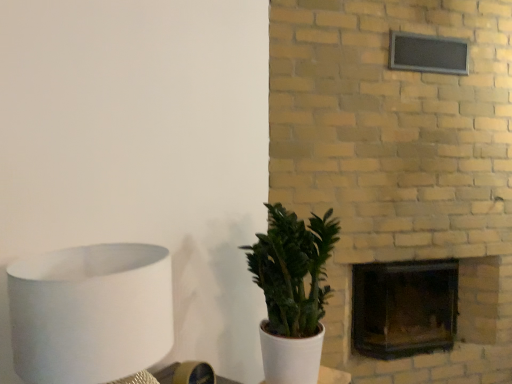
This screenshot has width=512, height=384. Find the location of `black glass fireplace at center-right`. black glass fireplace at center-right is located at coordinates (423, 305).

The width and height of the screenshot is (512, 384). What do you see at coordinates (90, 313) in the screenshot?
I see `white matte lampshade at left` at bounding box center [90, 313].

Identify the location of black glass fireplace at center-right. (423, 305).

Based on the photo, how many degrees apart are the facing directions of black glass fireplace at center-right and green matte plant at center?

There is a 39.9-degree angle between the facing directions of black glass fireplace at center-right and green matte plant at center.

Can you confirm if black glass fireplace at center-right is thinner than green matte plant at center?

No.

Is black glass fireplace at center-right touching green matte plant at center?

black glass fireplace at center-right and green matte plant at center are clearly separated.

Between black glass fireplace at center-right and green matte plant at center, which one has less height?

With less height is black glass fireplace at center-right.

Is black glass fireplace at center-right turned away from white matte lampshade at left?

No, white matte lampshade at left is not at the back of black glass fireplace at center-right.

Looking at this image, can you tell me how much black glass fireplace at center-right and white matte lampshade at left differ in facing direction?

41.7 degrees.

From a real-world perspective, who is located lower, black glass fireplace at center-right or white matte lampshade at left?

In real-world perspective, black glass fireplace at center-right is lower.

Is point (429, 292) more distant than point (71, 370)?

Yes, point (429, 292) is farther from viewer.

From the picture: Does white matte lampshade at left have a greater height compared to green matte plant at center?

Incorrect, the height of white matte lampshade at left is not larger of that of green matte plant at center.

Is white matte lampshade at left to the left or to the right of green matte plant at center in the image?

white matte lampshade at left is to the left of green matte plant at center.

From the image's perspective, which object appears higher, white matte lampshade at left or green matte plant at center?

white matte lampshade at left.

Would you say green matte plant at center is part of white matte lampshade at left's contents?

No, green matte plant at center is located outside of white matte lampshade at left.

Is white matte lampshade at left far away from black glass fireplace at center-right?

white matte lampshade at left is positioned a significant distance from black glass fireplace at center-right.

Which is more distant, (122, 331) or (389, 292)?

The point (389, 292) is farther.

From a real-world perspective, relative to black glass fireplace at center-right, is white matte lampshade at left vertically above or below?

From a real-world perspective, white matte lampshade at left is physically above black glass fireplace at center-right.

Which object is further away from the camera taking this photo, green matte plant at center or black glass fireplace at center-right?

Positioned behind is black glass fireplace at center-right.

Is green matte plant at center turned away from black glass fireplace at center-right?

green matte plant at center does not have its back to black glass fireplace at center-right.

Can you tell me how much green matte plant at center and black glass fireplace at center-right differ in facing direction?

They differ by 39.9 degrees in their facing directions.

Can you confirm if green matte plant at center is thinner than black glass fireplace at center-right?

Yes, green matte plant at center is thinner than black glass fireplace at center-right.

How far apart are green matte plant at center and white matte lampshade at left?

green matte plant at center is 26.92 inches from white matte lampshade at left.

Identify the location of houseplant below the white matte lampshade at left (from a real-world perspective). The width and height of the screenshot is (512, 384). (292, 292).

What's the angular difference between green matte plant at center and white matte lampshade at left's facing directions?

1.76 degrees.

Between green matte plant at center and white matte lampshade at left, which one is positioned in front?

white matte lampshade at left is closer to the camera.

Where is `houseplant on the left of black glass fireplace at center-right`? houseplant on the left of black glass fireplace at center-right is located at coordinates (292, 292).

Image resolution: width=512 pixels, height=384 pixels. Find the location of `fireplace located below the white matte lampshade at left (from the image's perspective)`. fireplace located below the white matte lampshade at left (from the image's perspective) is located at coordinates (423, 305).

From the image, which object appears to be nearer to white matte lampshade at left, green matte plant at center or black glass fireplace at center-right?

green matte plant at center is positioned closer to the anchor white matte lampshade at left.

Based on their spatial positions, is white matte lampshade at left or green matte plant at center closer to black glass fireplace at center-right?

Based on the image, green matte plant at center appears to be nearer to black glass fireplace at center-right.

Considering their positions, is green matte plant at center positioned closer to black glass fireplace at center-right than white matte lampshade at left?

Based on the image, green matte plant at center appears to be nearer to black glass fireplace at center-right.

Estimate the real-world distances between objects in this image. Which object is further from green matte plant at center, white matte lampshade at left or black glass fireplace at center-right?

The object further to green matte plant at center is black glass fireplace at center-right.

Based on their spatial positions, is black glass fireplace at center-right or green matte plant at center closer to white matte lampshade at left?

green matte plant at center is closer to white matte lampshade at left.

Consider the image. When comparing their distances from green matte plant at center, does black glass fireplace at center-right or white matte lampshade at left seem closer?

white matte lampshade at left lies closer to green matte plant at center than the other object.

I want to click on houseplant between white matte lampshade at left and black glass fireplace at center-right along the z-axis, so click(292, 292).